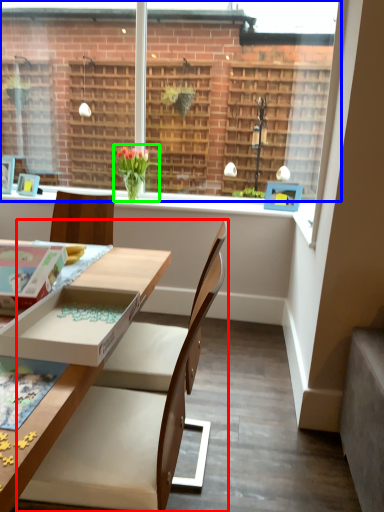
Question: Based on their relative distances, which object is farther from chair (highlighted by a red box)? Choose from window (highlighted by a blue box) and houseplant (highlighted by a green box).

Choices:
 (A) window
 (B) houseplant

Answer: (A)